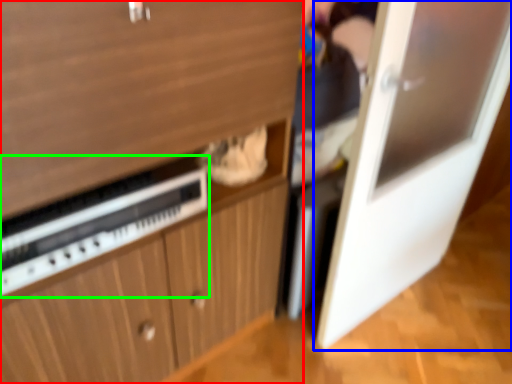
Question: Considering the real-world distances, which object is closest to cabinetry (highlighted by a red box)? door (highlighted by a blue box) or appliance (highlighted by a green box).

Choices:
 (A) door
 (B) appliance

Answer: (B)